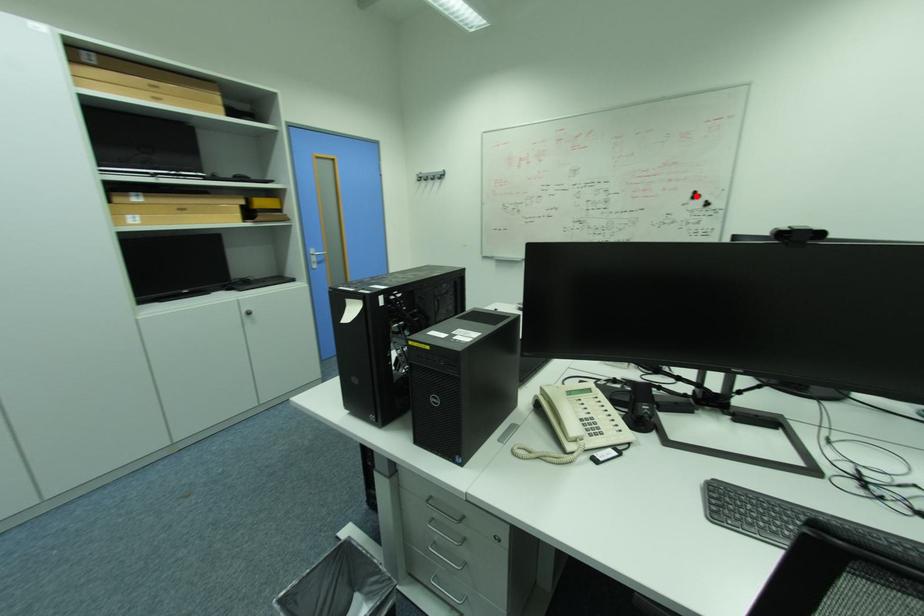
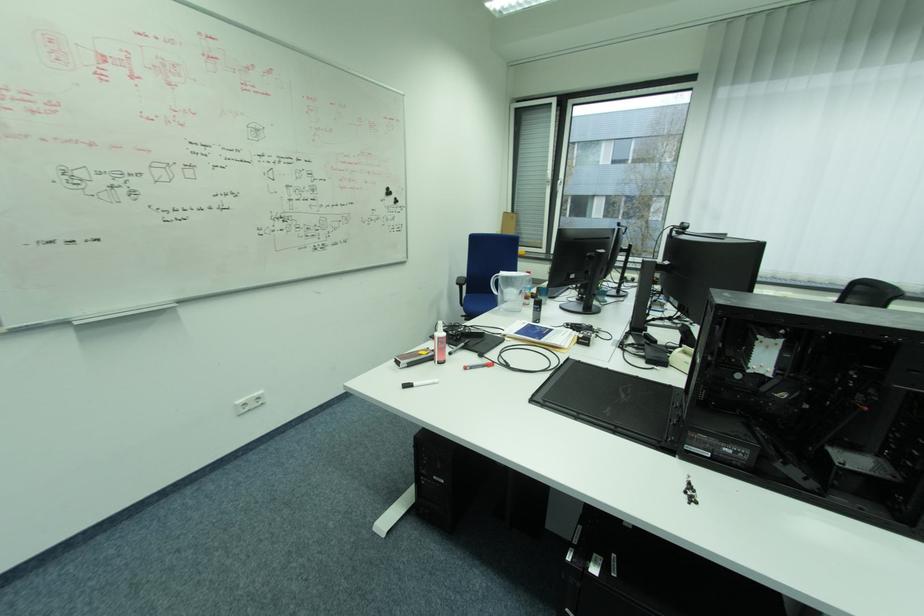
Locate, in the second image, the point that corresponds to the highlighted location in the first image.

(392, 192)